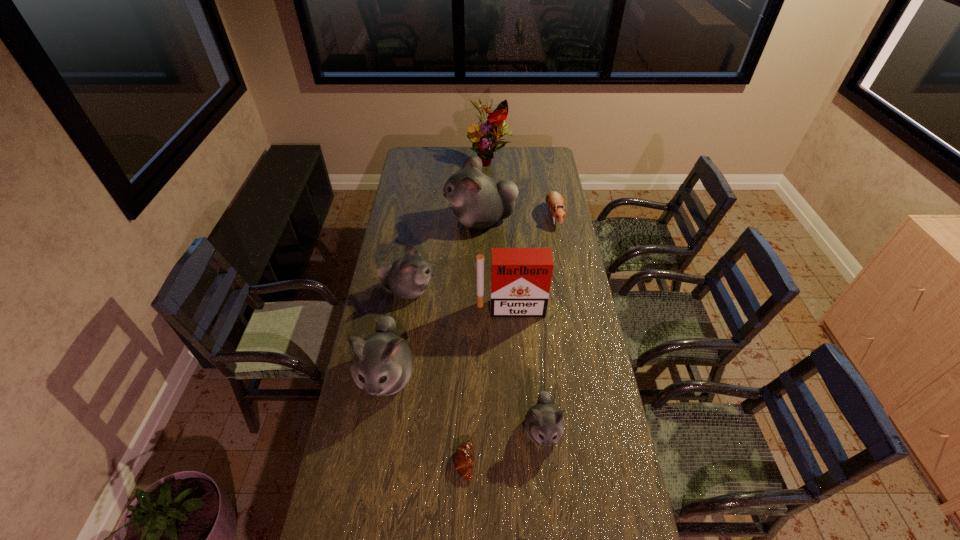
Identify the location of the farthest object. (491, 131).

Where is `the tallest hamster`? the tallest hamster is located at coordinates (478, 201).

What are the coordinates of `the farthest white hamster` in the screenshot? It's located at (478, 201).

I want to click on red cigarette case, so click(x=521, y=278).

Where is `the second tallest hamster`? Image resolution: width=960 pixels, height=540 pixels. the second tallest hamster is located at coordinates (382, 364).

You are a GUI agent. You are given a task and a screenshot of the screen. Output one action in this format:
    pyautogui.click(x=<x>, y=<y>)
    Task: Click on the third tallest hamster
    Image resolution: width=960 pixels, height=540 pixels.
    Given the screenshot: What is the action you would take?
    pyautogui.click(x=408, y=277)

Image resolution: width=960 pixels, height=540 pixels. In order to click on the second smallest white hamster in this screenshot , I will do click(408, 277).

Find the location of a particular element. the smallest white hamster is located at coordinates (544, 425).

In order to click on the sixth tallest object in this screenshot , I will do `click(544, 425)`.

The image size is (960, 540). I want to click on the seventh tallest object, so click(x=554, y=200).